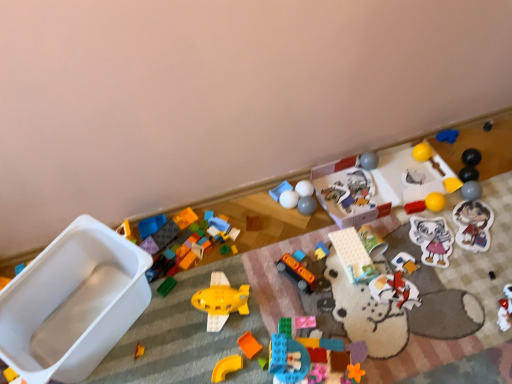
In order to click on vacant area that is situated to the right of matte plastic stickers at lower right, the 23th toy viewed from the left in this screenshot , I will do `click(501, 216)`.